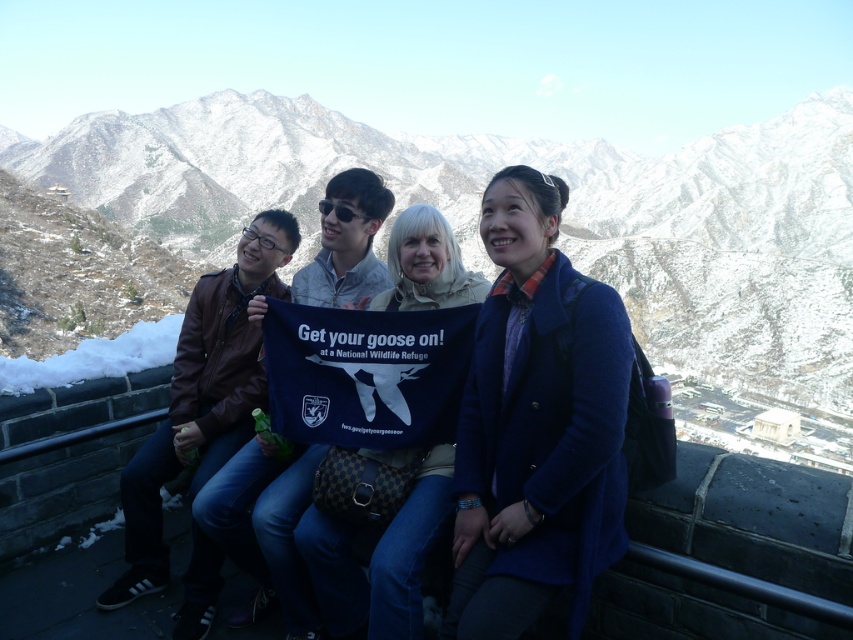
You are planning to hang a new banner in this scene. The banner you have is the same size as the blue fabric banner at center. Where should you place it so that it doesn not block the view of the snowy rock formation at upper center?

You should place the new banner below the snowy rock formation at upper center since the snowy rock formation is taller than the blue fabric banner at center, ensuring it won not block the view.

You are a photographer trying to capture a group photo of the four individuals on the stone wall. You want to ensure the blue woolen coat at center is centered in the frame. Given its coordinates at point 0.664, 0.631, where should you position your camera relative to the group?

To center the blue woolen coat at center, position your camera so that the coat is at the center point of the frame, which corresponds to the coordinates (537, 424) provided.

You are a photographer planning to take a picture of the blue fabric banner at center. There is a snowy rock formation at upper center in the way. Can you move the banner lower to avoid the rock formation blocking it?

The snowy rock formation at upper center is located above the blue fabric banner at center, so moving the banner lower would place it further away from the rock formation, avoiding obstruction.